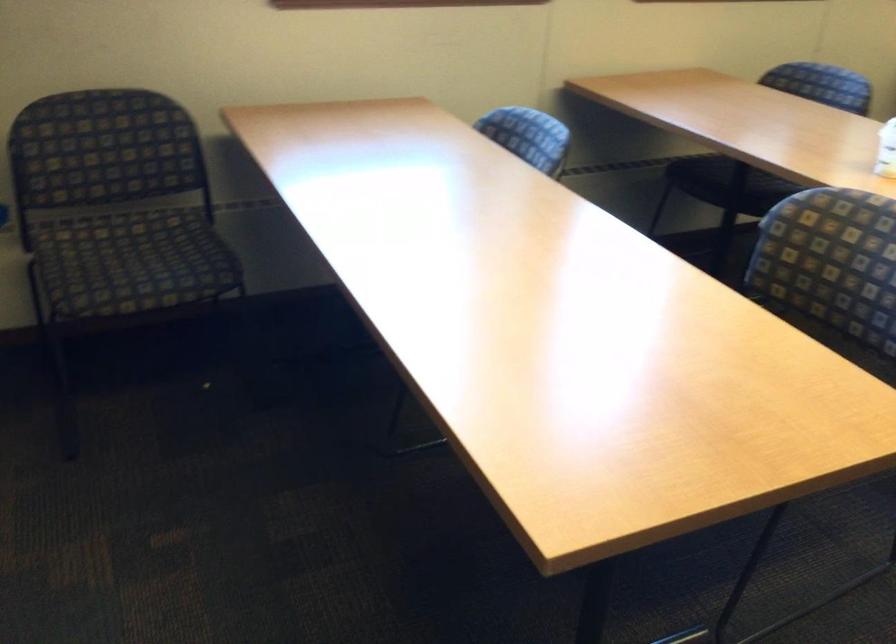
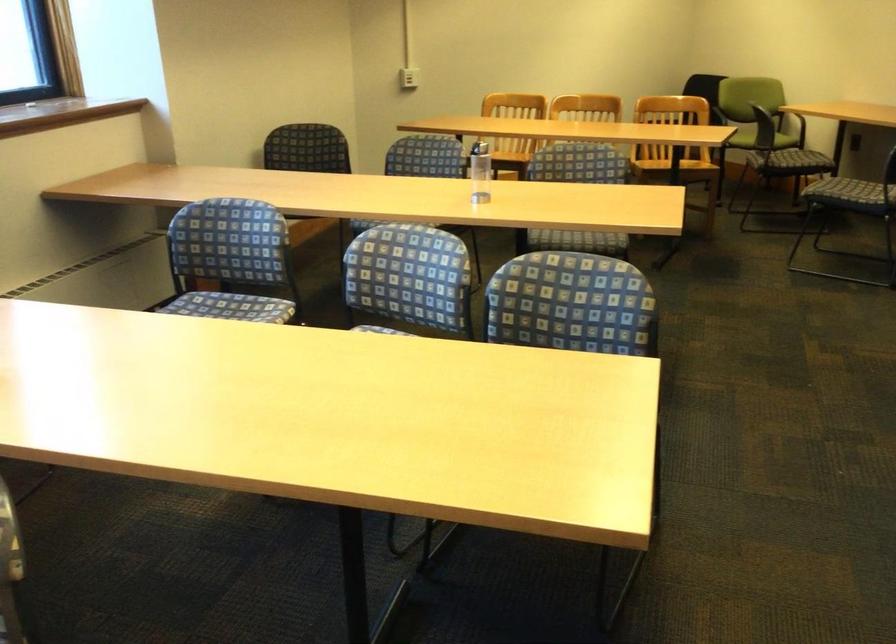
Question: The first image is from the beginning of the video and the second image is from the end. How did the camera likely rotate when shooting the video?

Choices:
 (A) Left
 (B) Right
 (C) Up
 (D) Down

Answer: (B)